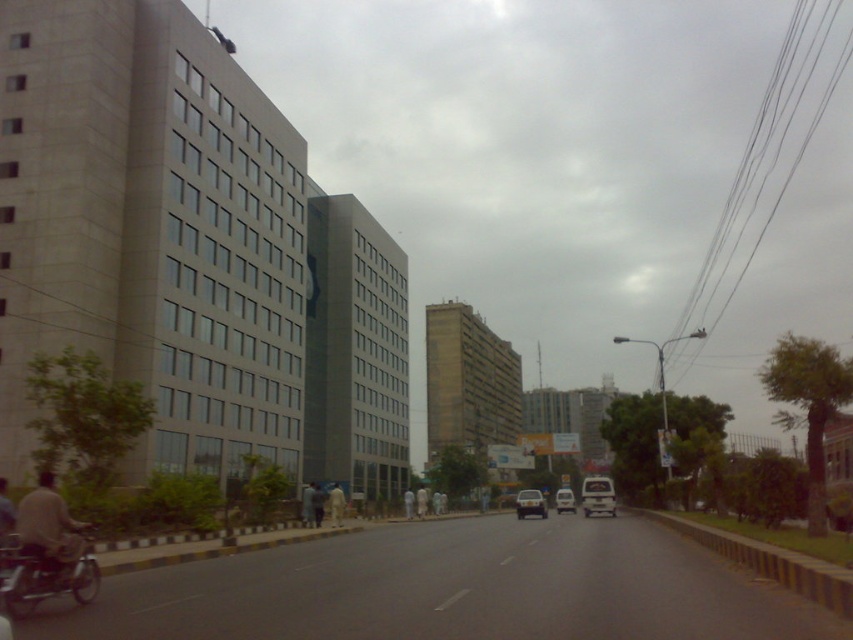
Question: Which object is positioned farthest from the matte black car at center?

Choices:
 (A) white matte person at center
 (B) white matte van at center

Answer: (A)

Question: Which of the following is the farthest from the observer?

Choices:
 (A) (78, 588)
 (B) (537, 492)

Answer: (B)

Question: Observing the image, what is the correct spatial positioning of matte black car at center in reference to white cotton person at center?

Choices:
 (A) right
 (B) left

Answer: (A)

Question: Does light brown leather jacket at lower left appear on the right side of matte black car at center?

Choices:
 (A) yes
 (B) no

Answer: (B)

Question: Which object is positioned farthest from the dark blue jeans at center?

Choices:
 (A) metallic silver motorcycle at lower left
 (B) white matte person at center

Answer: (A)

Question: Does metallic silver motorcycle at lower left appear on the right side of light brown leather jacket at lower left?

Choices:
 (A) yes
 (B) no

Answer: (A)